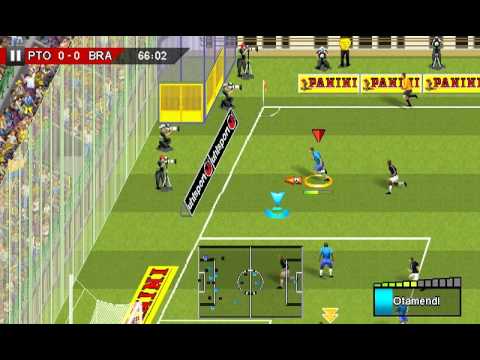
Image resolution: width=480 pixels, height=360 pixels. Identify the location of trash. (42, 102).